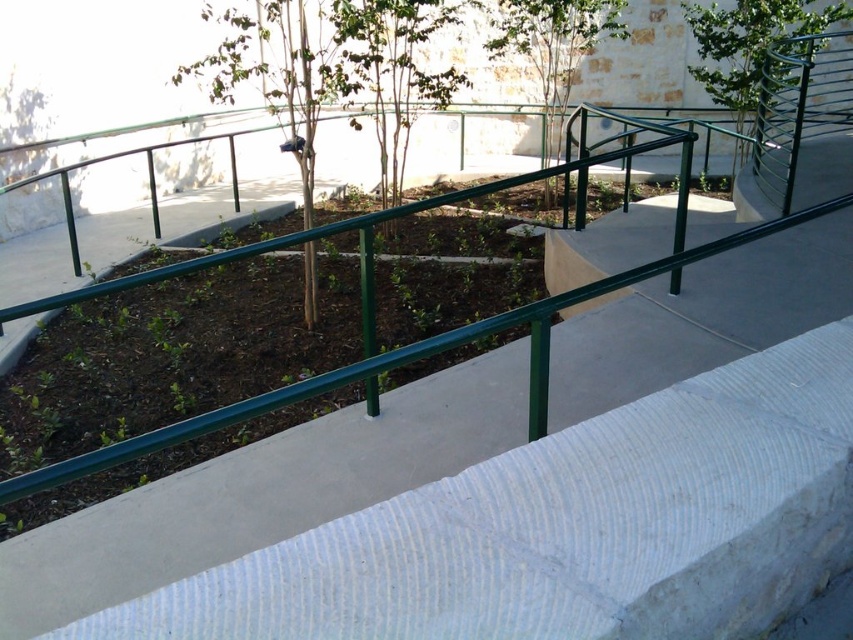
Question: Can you confirm if green textured tree at center is wider than green metal tree at upper right?

Choices:
 (A) no
 (B) yes

Answer: (B)

Question: Which point is closer to the camera taking this photo?

Choices:
 (A) (381, 49)
 (B) (759, 38)
 (C) (335, 54)

Answer: (C)

Question: Does green textured tree at center appear over green metal tree at upper right?

Choices:
 (A) no
 (B) yes

Answer: (B)

Question: Does green textured tree at center appear on the right side of green metal tree at upper right?

Choices:
 (A) no
 (B) yes

Answer: (A)

Question: Which of the following is the closest to the observer?

Choices:
 (A) green matte tree at center
 (B) green metal tree at upper right

Answer: (A)

Question: Which object appears closest to the camera in this image?

Choices:
 (A) green leafy tree at center
 (B) green matte tree at center

Answer: (B)